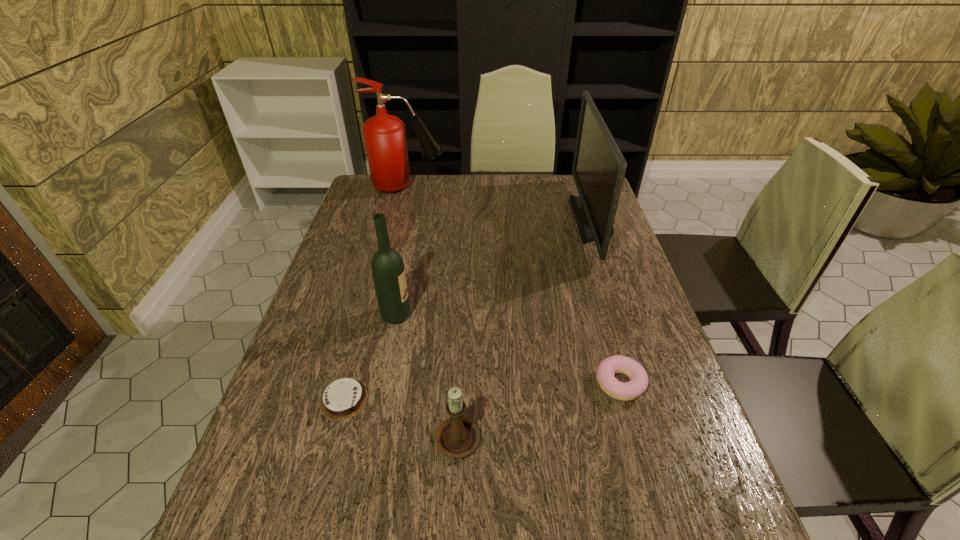
The image size is (960, 540). In order to click on free space in the image that satisfies the following two spatial constraints: 1. with the nozzle aimed from the fire extinguisher; 2. on the side of the third object from right to left with the handle in this screenshot , I will do coord(347,435).

The image size is (960, 540). I want to click on blank space that satisfies the following two spatial constraints: 1. with the nozzle aimed from the fire extinguisher; 2. on the side of the candle holder with the handle, so click(x=347, y=435).

Locate an element on the screen. This screenshot has height=540, width=960. free space that satisfies the following two spatial constraints: 1. with the nozzle aimed from the doughnut; 2. on the left side of the fire extinguisher is located at coordinates (359, 384).

Identify the location of free space in the image that satisfies the following two spatial constraints: 1. on the side of the third object from right to left with the handle; 2. on the labeled side of the fourth nearest object. This screenshot has height=540, width=960. (463, 315).

Where is `free space in the image that satisfies the following two spatial constraints: 1. with the nozzle aimed from the fire extinguisher; 2. on the side of the candle holder with the handle`? This screenshot has width=960, height=540. free space in the image that satisfies the following two spatial constraints: 1. with the nozzle aimed from the fire extinguisher; 2. on the side of the candle holder with the handle is located at coordinates (x=347, y=435).

You are a GUI agent. You are given a task and a screenshot of the screen. Output one action in this format:
    pyautogui.click(x=<x>, y=<y>)
    Task: Click on the free location that satisfies the following two spatial constraints: 1. on the screen side of the monitor; 2. on the front side of the shortest object
    
    Given the screenshot: What is the action you would take?
    pyautogui.click(x=653, y=400)